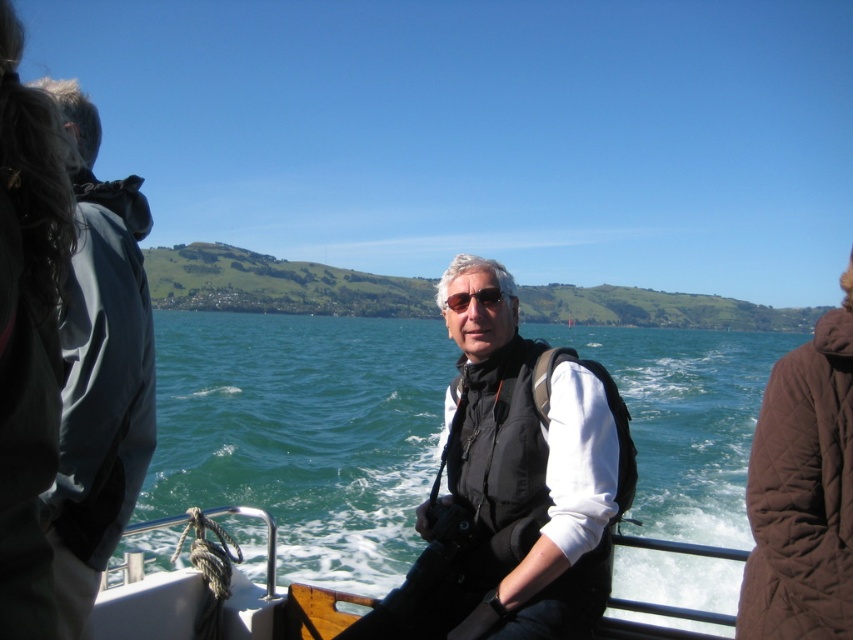
Can you confirm if dark gray jacket at left is positioned above white plastic boat at center?

Correct, dark gray jacket at left is located above white plastic boat at center.

You are a GUI agent. You are given a task and a screenshot of the screen. Output one action in this format:
    pyautogui.click(x=<x>, y=<y>)
    Task: Click on the dark gray jacket at left
    This screenshot has width=853, height=640.
    Given the screenshot: What is the action you would take?
    pyautogui.click(x=97, y=369)

Identify the location of dark gray jacket at left. (97, 369).

Which is more to the right, green water at center or dark gray jacket at left?

Positioned to the right is green water at center.

Who is more distant from viewer, (624, 372) or (136, 214)?

Point (624, 372)

You are a GUI agent. You are given a task and a screenshot of the screen. Output one action in this format:
    pyautogui.click(x=<x>, y=<y>)
    Task: Click on the green water at center
    The width and height of the screenshot is (853, 640).
    Given the screenshot: What is the action you would take?
    pyautogui.click(x=303, y=433)

Is green water at center above matte black sunglasses at center?

Actually, green water at center is below matte black sunglasses at center.

Can you confirm if green water at center is smaller than matte black sunglasses at center?

No.

Between point (186, 374) and point (463, 308), which one is positioned behind?

The point (186, 374) is more distant.

Where is `green water at center`? The width and height of the screenshot is (853, 640). green water at center is located at coordinates (303, 433).